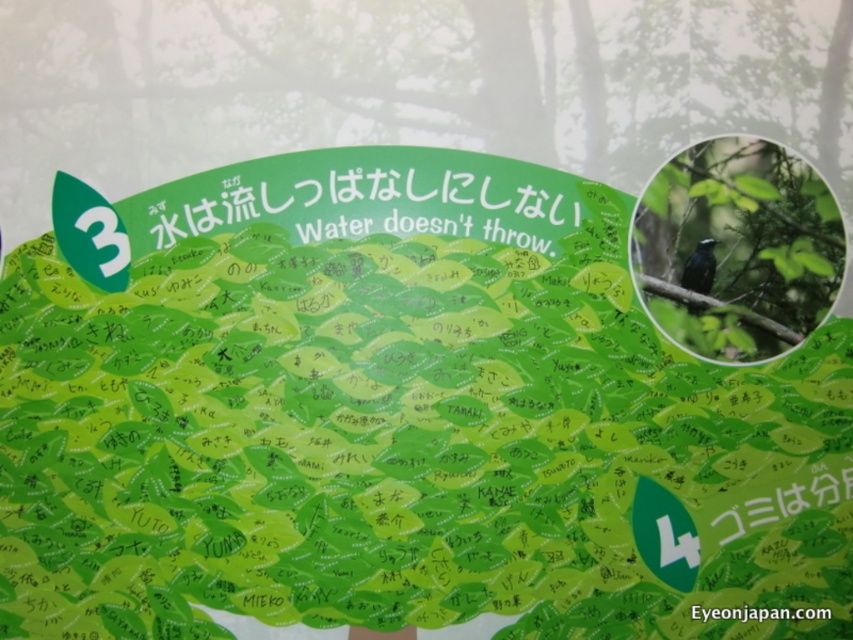
You are standing in front of the vibrant green poster described. You notice a specific point marked at coordinates (408, 84). What does this point indicate on the poster?

The point at (408, 84) marks the location of the green leafy tree at upper right on the poster.

You are standing at the camera position looking at the poster. There is a point marked at coordinates (601,60) on the poster. If you want to touch this point with a 6.5 feet long stick, will the stick be long enough?

The distance between the point at (601,60) and the camera is 8.14 feet. Since the stick is only 6.5 feet long, it is shorter than the required distance. Therefore, the stick will not be long enough to reach the point.

You are an artist planning to add a new element to the poster. You want to place a small golden star above both the green leafy tree at upper right and the shiny black bird at upper right. Based on their current positions, can you determine which object the star will be placed higher relative to?

The green leafy tree at upper right is taller than the shiny black bird at upper right, so placing the star above both means it will be higher relative to both objects.